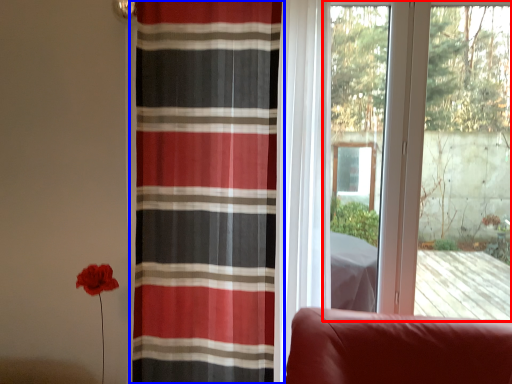
Question: Which of the following is the closest to the observer, window (highlighted by a red box) or curtain (highlighted by a blue box)?

Choices:
 (A) window
 (B) curtain

Answer: (B)